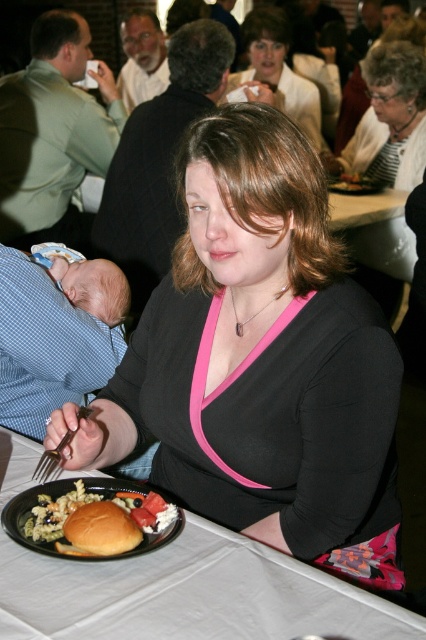
Question: Does black matte shirt at center appear on the right side of green matte shirt at left?

Choices:
 (A) yes
 (B) no

Answer: (A)

Question: Estimate the real-world distances between objects in this image. Which object is closer to the matte black sweater at center?

Choices:
 (A) black matte shirt at center
 (B) golden bread roll at plate center
 (C) blue checkered fabric baby at left

Answer: (C)

Question: In this image, where is black matte shirt at center located relative to matte plastic fork at upper center?

Choices:
 (A) below
 (B) above

Answer: (A)

Question: Which of the following is the farthest from the observer?

Choices:
 (A) matte plastic fork at upper center
 (B) golden bread roll at plate center
 (C) blue checkered fabric baby at left
 (D) silver metallic fork at lower left

Answer: (A)

Question: Which object appears farthest from the camera in this image?

Choices:
 (A) black matte shirt at center
 (B) brown bread at lower left

Answer: (A)

Question: Can you confirm if white plastic table at center is wider than matte white shirt at upper center?

Choices:
 (A) yes
 (B) no

Answer: (A)